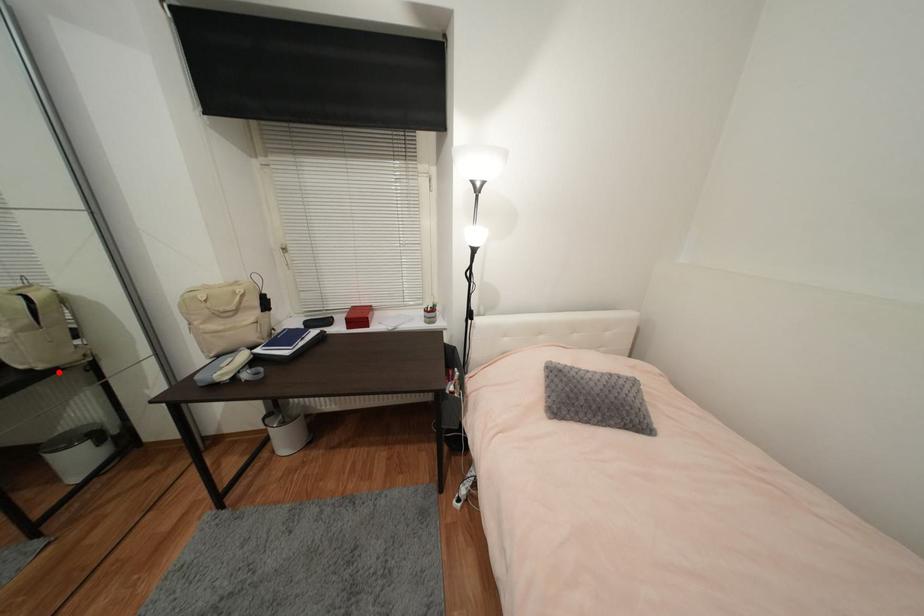
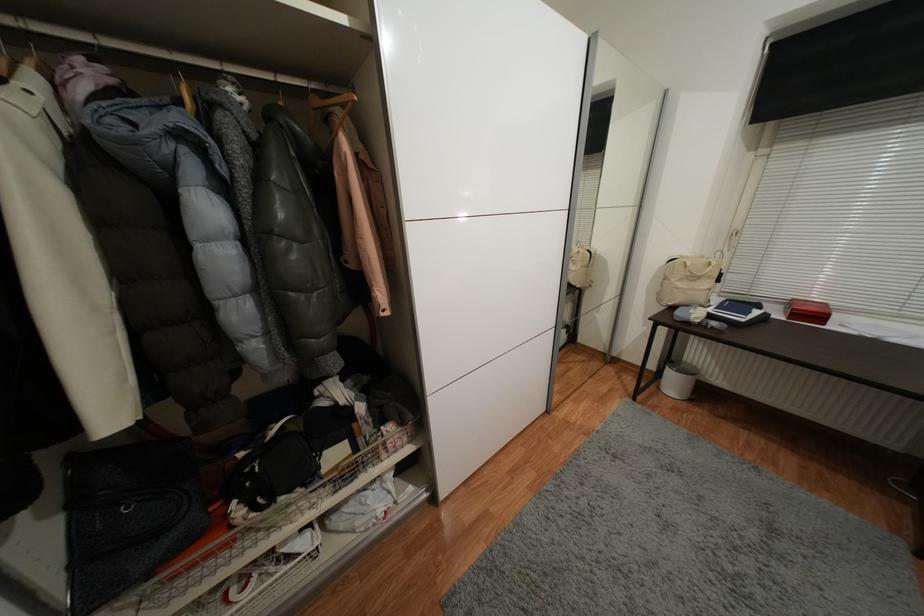
Question: I am providing you with two images of the same scene from different viewpoints. In image1, a red point is highlighted. Considering the same 3D point in image2, which of the following is correct?

Choices:
 (A) It is closer
 (B) It is farther

Answer: (B)